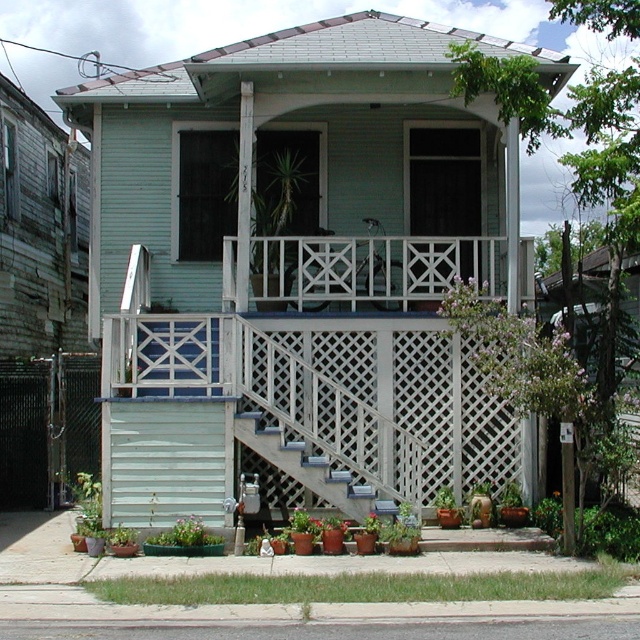
How distant is green leafy bush at lower right from green leafy plant at lower center?

The distance of green leafy bush at lower right from green leafy plant at lower center is 13.90 feet.

In the scene shown: Who is positioned more to the right, green leafy bush at lower right or green leafy plant at lower center?

From the viewer's perspective, green leafy bush at lower right appears more on the right side.

This screenshot has height=640, width=640. I want to click on green leafy bush at lower right, so click(x=611, y=531).

Is green leafy bush at lower right bigger than green leafy plant at center?

Yes, green leafy bush at lower right is bigger than green leafy plant at center.

Does green leafy bush at lower right have a greater height compared to green leafy plant at center?

Indeed, green leafy bush at lower right has a greater height compared to green leafy plant at center.

Is point (620, 548) behind point (499, 496)?

No, it is not.

I want to click on green leafy bush at lower right, so click(611, 531).

Does green leafy bush at lower right have a lesser width compared to green matte plant at lower center?

In fact, green leafy bush at lower right might be wider than green matte plant at lower center.

Does green leafy bush at lower right have a larger size compared to green matte plant at lower center?

Yes.

Which is behind, point (628, 554) or point (125, 536)?

Point (125, 536)

Identify the location of green leafy bush at lower right. The image size is (640, 640). (611, 531).